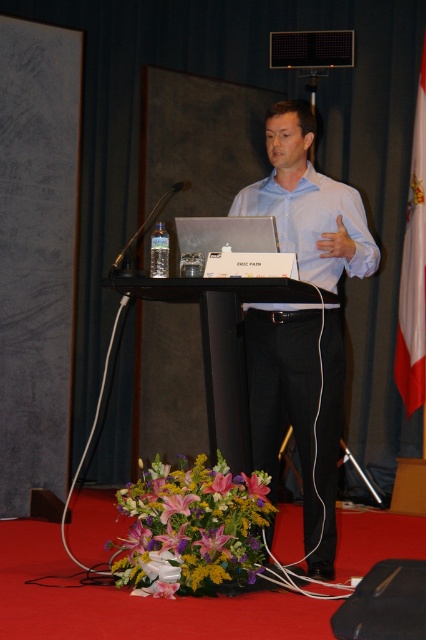
Find the location of `white glossy shirt at center`. white glossy shirt at center is located at coordinates click(299, 408).

Who is more forward, (x=334, y=326) or (x=224, y=476)?

Point (x=224, y=476)

Where is `white glossy shirt at center`? white glossy shirt at center is located at coordinates (299, 408).

Can you confirm if white glossy shirt at center is bigger than white smooth shirt at center?

Correct, white glossy shirt at center is larger in size than white smooth shirt at center.

Is point (301, 227) behind point (345, 198)?

That is False.

Find the location of `white glossy shirt at center`. white glossy shirt at center is located at coordinates (299, 408).

Does white glossy shirt at center have a lesser width compared to white fabric flag at right?

No.

Is point (276, 401) closer to viewer compared to point (414, 145)?

Yes, point (276, 401) is closer to viewer.

Image resolution: width=426 pixels, height=640 pixels. Describe the element at coordinates (299, 408) in the screenshot. I see `white glossy shirt at center` at that location.

The image size is (426, 640). Find the location of `white glossy shirt at center`. white glossy shirt at center is located at coordinates (299, 408).